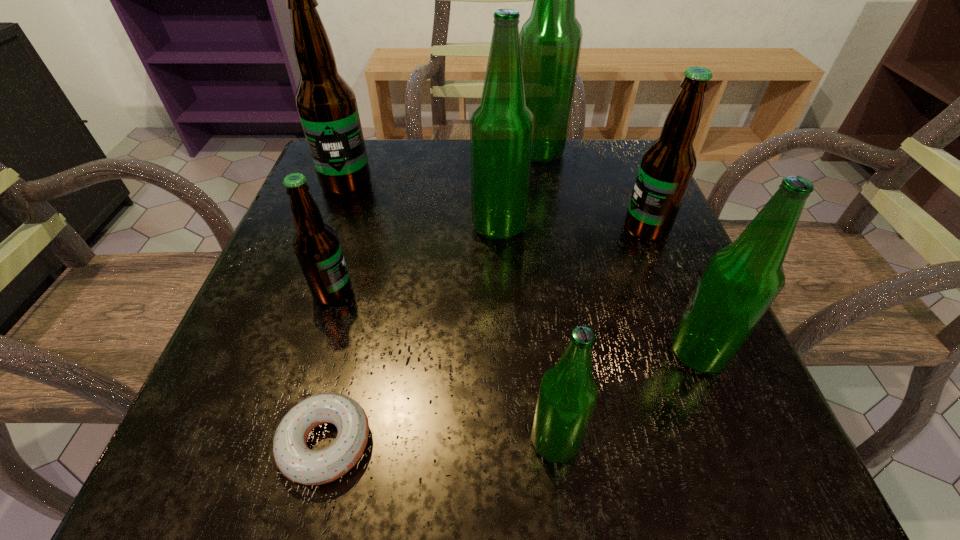
You are a GUI agent. You are given a task and a screenshot of the screen. Output one action in this format:
    pyautogui.click(x=<x>, y=<y>)
    Task: Click on the free region located 0.350m on the label of the nearest green beer bottle
    
    Given the screenshot: What is the action you would take?
    pyautogui.click(x=254, y=442)

The width and height of the screenshot is (960, 540). Identify the location of free space located on the back of the shortest object. (377, 234).

Image resolution: width=960 pixels, height=540 pixels. I want to click on beer bottle present at the near edge, so click(x=567, y=397).

At what (x,y) coordinates should I click in order to perform the action: click on doughnut that is at the near edge. Please return your answer as a coordinate pair (x, y). The height and width of the screenshot is (540, 960). Looking at the image, I should click on (294, 459).

The height and width of the screenshot is (540, 960). Identify the location of doughnut that is at the left edge. (294, 459).

The height and width of the screenshot is (540, 960). Find the location of `object present at the far left corner`. object present at the far left corner is located at coordinates (326, 104).

You are a GUI agent. You are given a task and a screenshot of the screen. Output one action in this format:
    pyautogui.click(x=<x>, y=<y>)
    Task: Click on the object that is at the near left corner
    The width and height of the screenshot is (960, 540).
    Given the screenshot: What is the action you would take?
    pyautogui.click(x=294, y=459)

Identify the location of free location at the far edge. (413, 155).

Find the location of `free space at the near edge of the desktop`. free space at the near edge of the desktop is located at coordinates (644, 481).

Image resolution: width=960 pixels, height=540 pixels. In the image, there is a desktop. In order to click on free space at the left edge in this screenshot , I will do `click(364, 198)`.